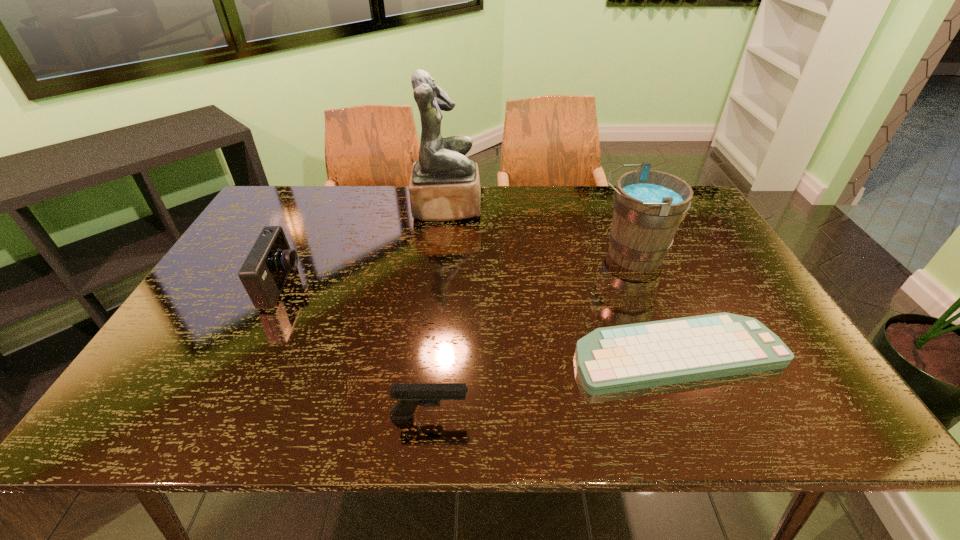
The width and height of the screenshot is (960, 540). I want to click on the farthest object, so click(x=444, y=185).

The image size is (960, 540). I want to click on sculpture, so click(444, 185).

This screenshot has width=960, height=540. I want to click on wine bucket, so click(x=649, y=205).

This screenshot has width=960, height=540. Find the location of `the third shortest object`. the third shortest object is located at coordinates (263, 274).

At what (x,y) coordinates should I click in order to perform the action: click on camera. Please return your answer as a coordinate pair (x, y). The width and height of the screenshot is (960, 540). Looking at the image, I should click on (263, 274).

I want to click on pistol, so click(x=410, y=395).

Where is `the fourth tallest object`? the fourth tallest object is located at coordinates (410, 395).

Locate an element on the screen. computer keyboard is located at coordinates pyautogui.click(x=620, y=358).

The height and width of the screenshot is (540, 960). What are the coordinates of `the shortest object` in the screenshot? It's located at (620, 358).

At what (x,y) coordinates should I click in order to perform the action: click on free space located 0.120m in a relaxed pose on the farthest object. Please return your answer as a coordinate pair (x, y). Image resolution: width=960 pixels, height=540 pixels. Looking at the image, I should click on (516, 207).